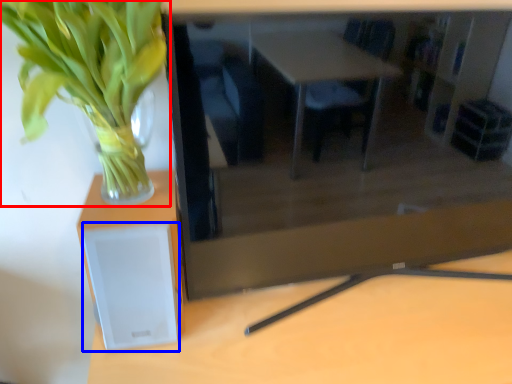
Question: Which point is closer to the camera, houseplant (highlighted by a red box) or speaker (highlighted by a blue box)?

Choices:
 (A) houseplant
 (B) speaker

Answer: (A)